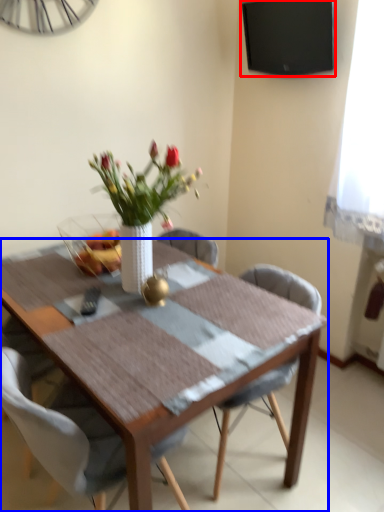
Question: Which of the following is the farthest to the observer, television (highlighted by a red box) or kitchen & dining room table (highlighted by a blue box)?

Choices:
 (A) television
 (B) kitchen & dining room table

Answer: (A)